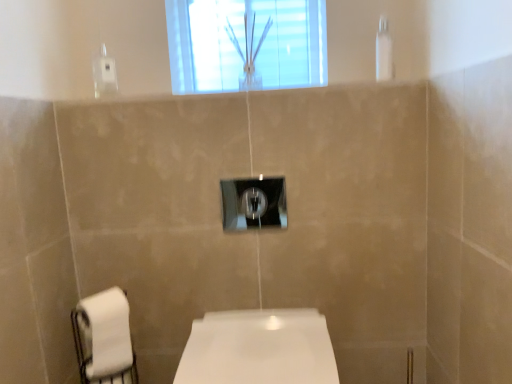
Question: Is white glossy toilet at center next to white matte toilet paper at lower left?

Choices:
 (A) no
 (B) yes

Answer: (A)

Question: Is white glossy toilet at center at the right side of white matte toilet paper at lower left?

Choices:
 (A) no
 (B) yes

Answer: (B)

Question: From the image's perspective, is white glossy toilet at center below white matte toilet paper at lower left?

Choices:
 (A) no
 (B) yes

Answer: (B)

Question: Is white matte toilet paper at lower left inside white glossy toilet at center?

Choices:
 (A) no
 (B) yes

Answer: (A)

Question: From a real-world perspective, is white glossy toilet at center on top of white matte toilet paper at lower left?

Choices:
 (A) yes
 (B) no

Answer: (B)

Question: In terms of width, does satin nickel light switch at center look wider or thinner when compared to clear glass vase at upper center?

Choices:
 (A) wide
 (B) thin

Answer: (B)

Question: Would you say satin nickel light switch at center is inside or outside clear glass vase at upper center?

Choices:
 (A) outside
 (B) inside

Answer: (A)

Question: Does point (284, 183) appear closer or farther from the camera than point (190, 14)?

Choices:
 (A) farther
 (B) closer

Answer: (B)

Question: Is satin nickel light switch at center bigger or smaller than clear glass vase at upper center?

Choices:
 (A) small
 (B) big

Answer: (A)

Question: Which is correct: clear glass vase at upper center is inside clear plastic shower at upper right, or outside of it?

Choices:
 (A) inside
 (B) outside

Answer: (B)

Question: Is clear glass vase at upper center bigger or smaller than clear plastic shower at upper right?

Choices:
 (A) small
 (B) big

Answer: (B)

Question: In the image, is clear glass vase at upper center positioned in front of or behind clear plastic shower at upper right?

Choices:
 (A) behind
 (B) front

Answer: (A)

Question: Is clear glass vase at upper center to the left or to the right of clear plastic shower at upper right in the image?

Choices:
 (A) right
 (B) left

Answer: (B)

Question: Considering the positions of white glossy toilet at center and clear glass vase at upper center in the image, is white glossy toilet at center taller or shorter than clear glass vase at upper center?

Choices:
 (A) short
 (B) tall

Answer: (A)

Question: Based on their sizes in the image, would you say white glossy toilet at center is bigger or smaller than clear glass vase at upper center?

Choices:
 (A) big
 (B) small

Answer: (A)